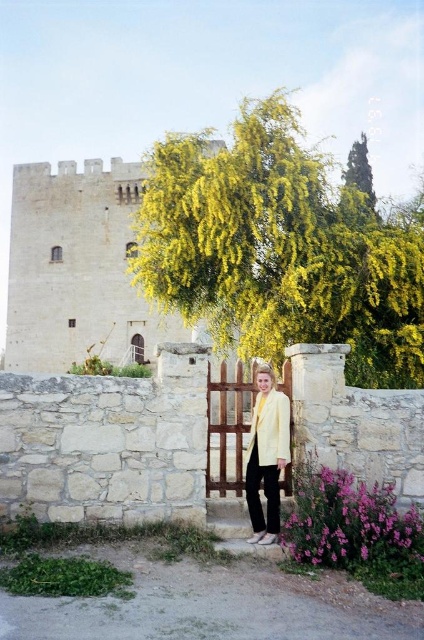
Which is in front, point (28, 172) or point (267, 424)?

Point (267, 424) is more forward.

Is white stone tower at upper left above light yellow fabric jacket at center?

Yes, white stone tower at upper left is above light yellow fabric jacket at center.

Describe the element at coordinates (78, 268) in the screenshot. I see `white stone tower at upper left` at that location.

The image size is (424, 640). I want to click on white stone tower at upper left, so point(78,268).

Which is in front, point (237, 291) or point (354, 173)?

Point (237, 291)

Between yellow-green foliage at center and green leafy tree at upper right, which one has less height?

With less height is green leafy tree at upper right.

You are a GUI agent. You are given a task and a screenshot of the screen. Output one action in this format:
    pyautogui.click(x=<x>, y=<y>)
    Task: Click on the yellow-green foliage at center
    
    Given the screenshot: What is the action you would take?
    pyautogui.click(x=279, y=250)

I want to click on yellow-green foliage at center, so click(x=279, y=250).

Consider the image. Is yellow-green foliage at center shorter than white stone tower at upper left?

No.

Who is more distant from viewer, (x=359, y=246) or (x=215, y=147)?

The point (x=215, y=147) is behind.

You are a GUI agent. You are given a task and a screenshot of the screen. Output one action in this format:
    pyautogui.click(x=<x>, y=<y>)
    Task: Click on the yellow-green foliage at center
    
    Given the screenshot: What is the action you would take?
    pyautogui.click(x=279, y=250)